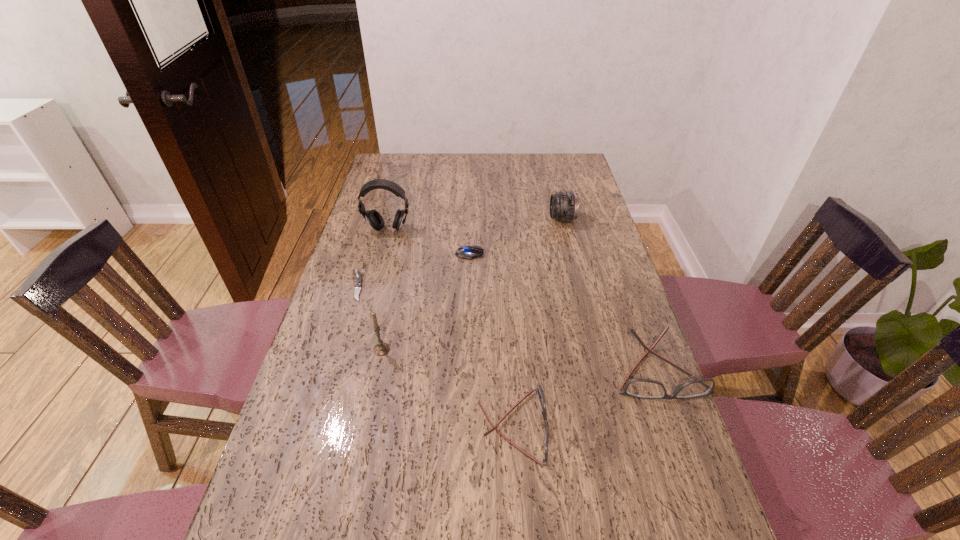
Locate an element on the screen. This screenshot has width=960, height=540. the third shortest object is located at coordinates (538, 391).

Locate an element on the screen. This screenshot has height=540, width=960. the shorter spectacles is located at coordinates (538, 391).

Find the location of a particular element. the taller spectacles is located at coordinates click(639, 388).

At what (x,y) coordinates should I click in order to perform the action: click on the right spectacles. Please return your answer as a coordinate pair (x, y). The image size is (960, 540). Looking at the image, I should click on (639, 388).

In order to click on telephoto lens in this screenshot , I will do `click(564, 207)`.

The image size is (960, 540). In order to click on earphone in this screenshot , I will do `click(373, 217)`.

Locate an element on the screen. Image resolution: width=960 pixels, height=540 pixels. candle is located at coordinates (380, 349).

Image resolution: width=960 pixels, height=540 pixels. Identify the location of the second shortest object. (465, 252).

Identify the location of the third farthest object. Image resolution: width=960 pixels, height=540 pixels. (465, 252).

This screenshot has height=540, width=960. I want to click on the fourth nearest object, so click(358, 278).